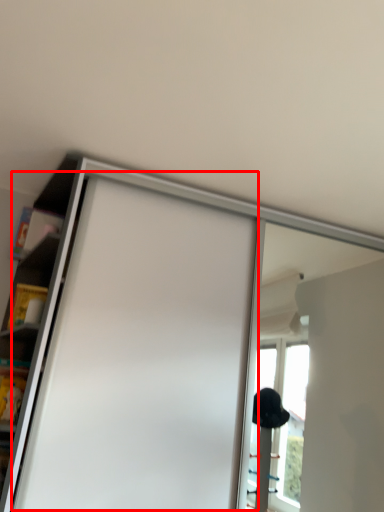
Question: Observing the image, what is the correct spatial positioning of screen door (annotated by the red box) in reference to shelf?

Choices:
 (A) left
 (B) right

Answer: (B)